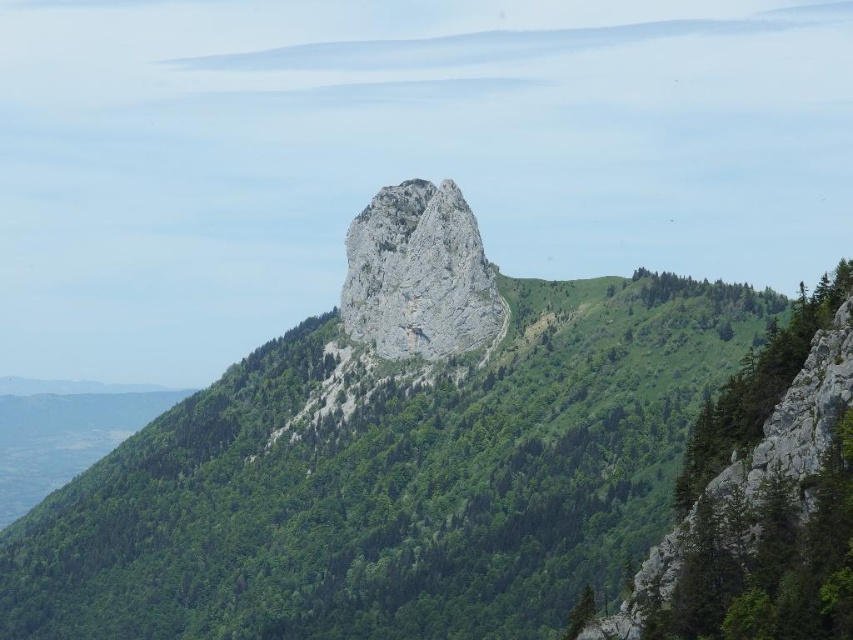
Does green leafy tree at center come in front of gray rocky peak at center?

Yes, green leafy tree at center is closer to the viewer.

Who is positioned more to the right, green leafy tree at center or gray rocky peak at center?

gray rocky peak at center is more to the right.

Locate an element on the screen. Image resolution: width=853 pixels, height=640 pixels. green leafy tree at center is located at coordinates (392, 483).

Find the location of a particular element. The height and width of the screenshot is (640, 853). green leafy tree at center is located at coordinates coord(392,483).